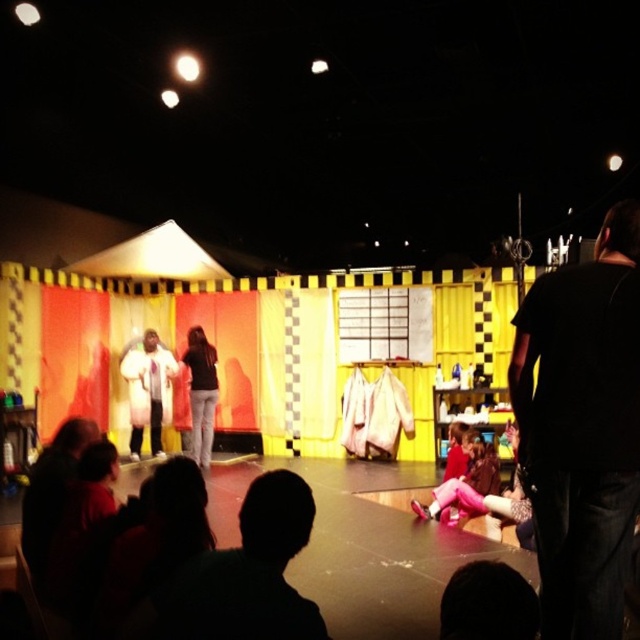
Is white fluffy coat at center closer to camera compared to pink fabric pants at center?

No, white fluffy coat at center is further to the viewer.

Is white fluffy coat at center above pink fabric pants at center?

Correct, white fluffy coat at center is located above pink fabric pants at center.

Consider the image. Who is more forward, [138,420] or [472,456]?

Positioned in front is point [472,456].

Where is `white fluffy coat at center`? white fluffy coat at center is located at coordinates click(147, 390).

Between black t-shirt at right and silhouette head at lower center, which one has less height?

With less height is silhouette head at lower center.

Is black t-shirt at right below silhouette head at lower center?

Incorrect, black t-shirt at right is not positioned below silhouette head at lower center.

Between point (541, 289) and point (273, 506), which one is positioned in front?

Point (273, 506) is in front.

In order to click on black t-shirt at right in this screenshot , I will do `click(580, 428)`.

Where is `silhouette head at lower center`? Image resolution: width=640 pixels, height=640 pixels. silhouette head at lower center is located at coordinates (248, 573).

Between silhouette head at lower center and white fluffy coat at center, which one has more height?

Standing taller between the two is white fluffy coat at center.

Does point (209, 563) come behind point (157, 417)?

No, (209, 563) is in front of (157, 417).

Find the location of a particular element. Image resolution: width=640 pixels, height=640 pixels. silhouette head at lower center is located at coordinates (248, 573).